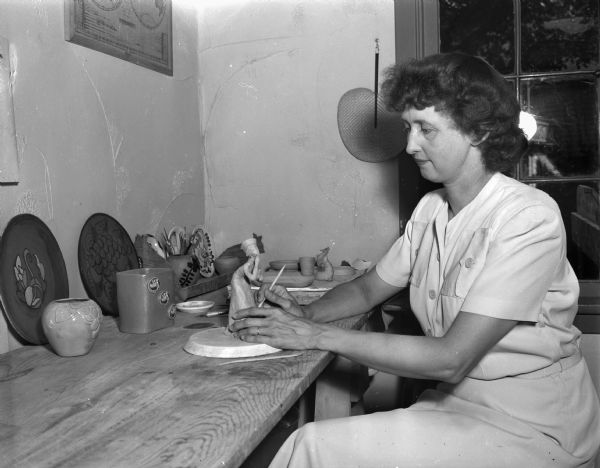
Locate an element on the screen. This screenshot has height=468, width=600. table is located at coordinates tap(178, 391).